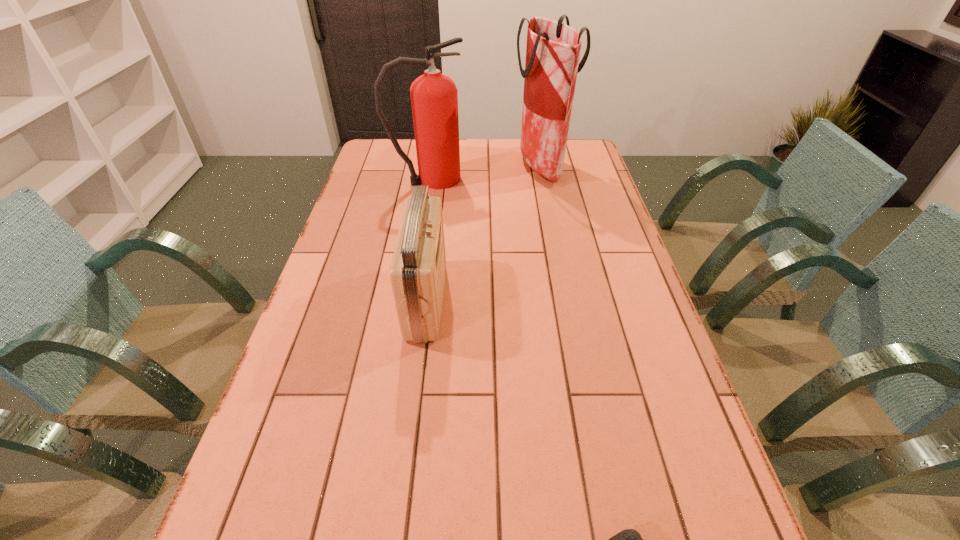
Find the location of a particular element. This screenshot has width=960, height=540. the closest object to the control is located at coordinates (417, 273).

Identify which object is located as the second nearest to the fire extinguisher. Please provide its 2D coordinates. Your answer should be formatted as a tuple, i.e. [(x, y)], where the tuple contains the x and y coordinates of a point satisfying the conditions above.

[(417, 273)]